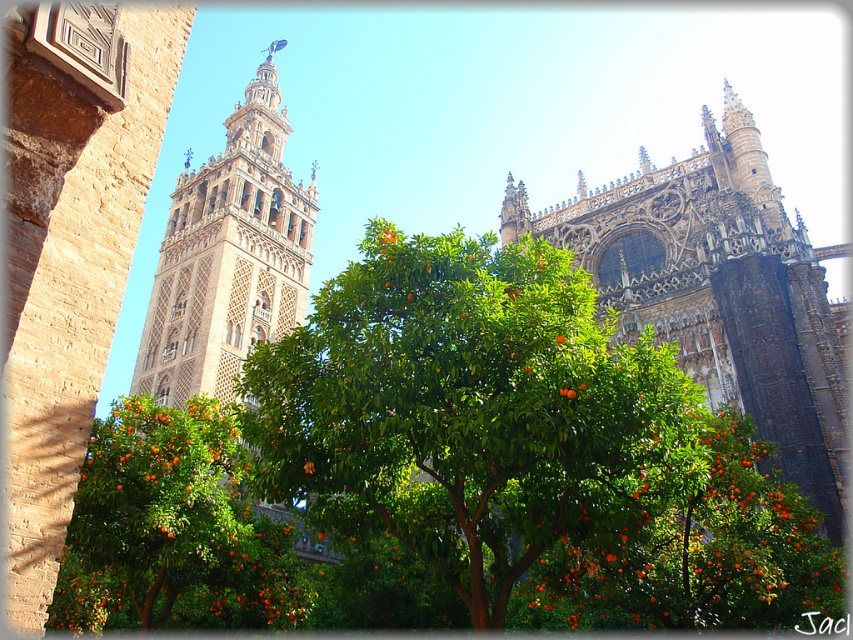
Between green leafy tree with orange fruits at center and beige stone tower at left, which one has more height?

beige stone tower at left is taller.

Between point (119, 481) and point (309, 268), which one is positioned in front?

Point (119, 481) is in front.

Where is `green leafy tree with orange fruits at center`? green leafy tree with orange fruits at center is located at coordinates (173, 529).

Does green leafy tree at center lie behind beige stone tower at left?

No, green leafy tree at center is in front of beige stone tower at left.

Does point (276, 365) come behind point (259, 67)?

No, (276, 365) is in front of (259, 67).

Find the location of `green leafy tree at center`. green leafy tree at center is located at coordinates click(469, 410).

Find the location of a particular element. The height and width of the screenshot is (640, 853). green leafy tree at center is located at coordinates (469, 410).

Which is below, green leafy tree at center or green leafy tree with orange fruits at center?

Positioned lower is green leafy tree with orange fruits at center.

Where is `green leafy tree at center`? The image size is (853, 640). green leafy tree at center is located at coordinates (469, 410).

Is point (485, 262) behind point (68, 554)?

No, it is not.

This screenshot has width=853, height=640. I want to click on green leafy tree at center, so click(x=469, y=410).